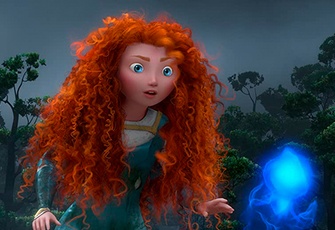
This screenshot has height=230, width=335. I want to click on yellow trim, so click(156, 127).